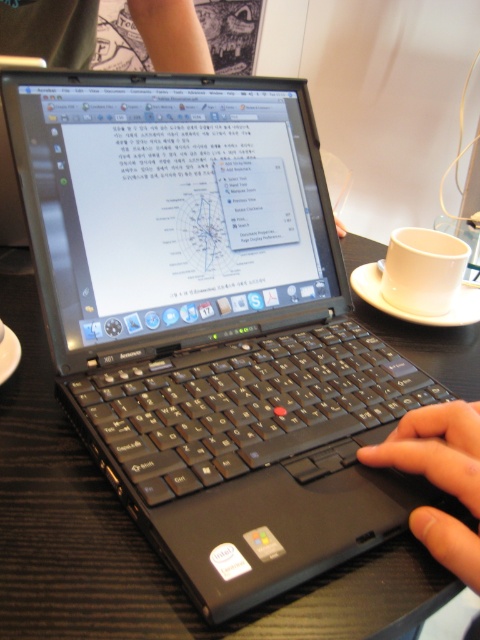
Is white ceramic cup at right to the left of white ceramic saucer at right from the viewer's perspective?

Correct, you'll find white ceramic cup at right to the left of white ceramic saucer at right.

Is point (436, 240) more distant than point (369, 284)?

That is False.

Find the location of `white ceramic cup at right`. white ceramic cup at right is located at coordinates coord(422,269).

Find the location of a particular element. The height and width of the screenshot is (640, 480). white ceramic cup at right is located at coordinates (422, 269).

Is black matte hand at lower right shorter than white ceramic cup at right?

Indeed, black matte hand at lower right has a lesser height compared to white ceramic cup at right.

Does black matte hand at lower right appear over white ceramic cup at right?

Actually, black matte hand at lower right is below white ceramic cup at right.

At what (x,y) coordinates should I click in order to perform the action: click on black matte hand at lower right. Please return your answer as a coordinate pair (x, y). Looking at the image, I should click on (435, 449).

Between point (467, 436) and point (396, 308), which one is positioned behind?

Point (396, 308)

Is black matte hand at lower right positioned before white ceramic saucer at right?

That is True.

Does point (470, 433) come farther from viewer compared to point (456, 307)?

No, (470, 433) is closer to viewer.

In order to click on black matte hand at lower right in this screenshot , I will do `click(435, 449)`.